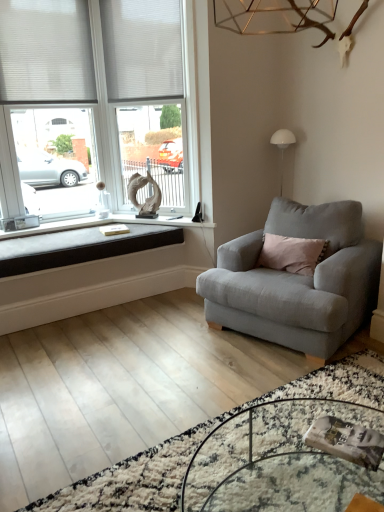
Find the location of a particular element. blank space above clear glass table at lower center (from a real-world perspective) is located at coordinates (300, 460).